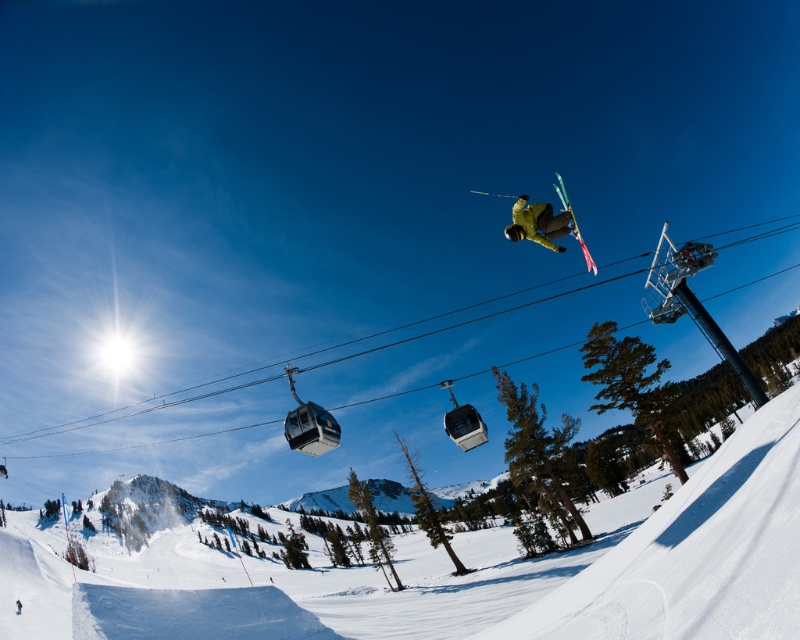
You are a photographer planning to capture a wide shot of the ski resort scene. You want to ensure both the metallic cable car at center and the yellow matte snowboarder at center are clearly visible in your photo. Given their sizes, which object should you focus on first to ensure proper exposure and sharpness?

The metallic cable car at center is larger in size than the yellow matte snowboarder at center, so you should focus on the metallic cable car at center first to ensure proper exposure and sharpness since it occupies more of the frame.

You are a photographer standing at the ski resort and want to take a photo that includes both the metallic cable car at center and the yellow matte snowboarder at center. Which object should you focus on first to ensure it appears sharp in the photo?

You should focus on the metallic cable car at center first because it is closer to you than the yellow matte snowboarder at center, so focusing on it will keep it sharp while the snowboarder might be slightly out of focus if not adjusted. Alternatively, you can adjust your focus point to balance both distances.